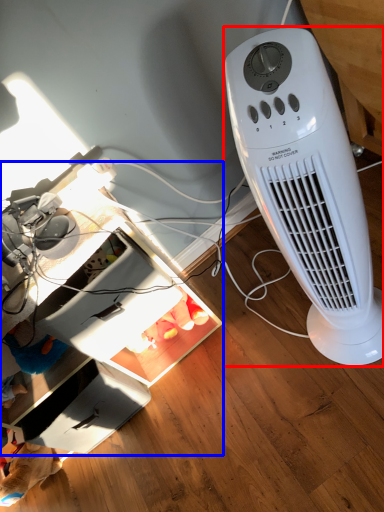
Question: Which object appears closest to the camera in this image, home appliance (highlighted by a red box) or computer desk (highlighted by a blue box)?

Choices:
 (A) home appliance
 (B) computer desk

Answer: (A)